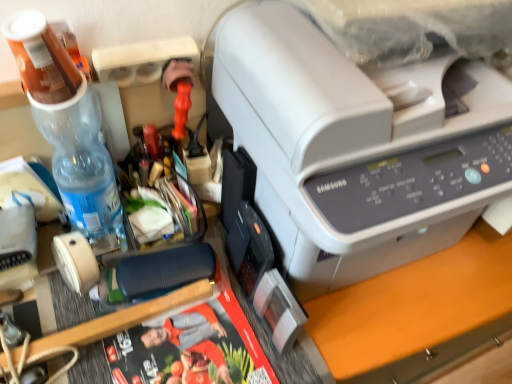
The image size is (512, 384). In order to click on empty space that is ontop of white plastic printer at upper right in this screenshot , I will do `click(353, 42)`.